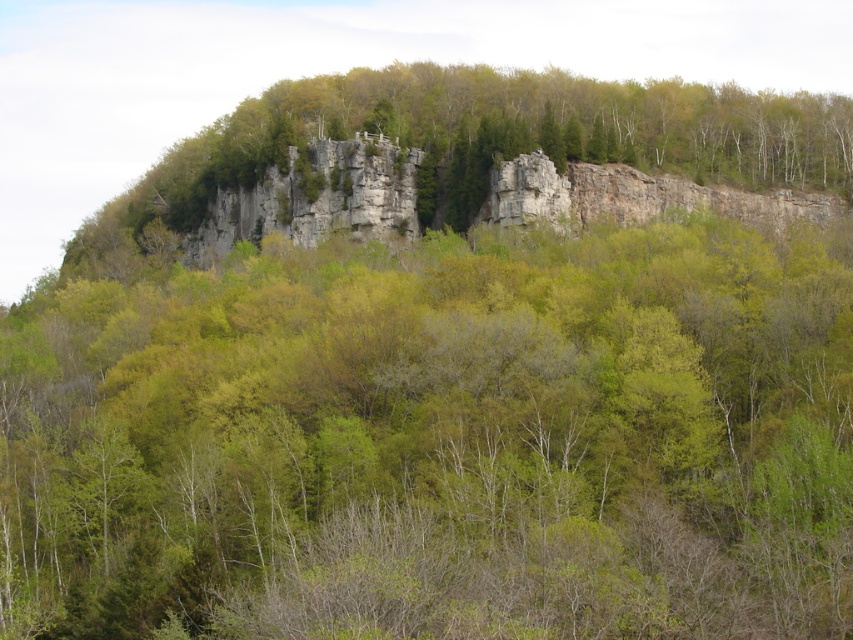
This screenshot has width=853, height=640. What do you see at coordinates (439, 442) in the screenshot?
I see `green leafy tree at upper center` at bounding box center [439, 442].

Who is taller, green leafy tree at upper center or green leafy tree at center?

With more height is green leafy tree at center.

Is point (134, 371) closer to camera compared to point (431, 148)?

Yes, it is in front of point (431, 148).

Identify the location of green leafy tree at upper center. The height and width of the screenshot is (640, 853). (439, 442).